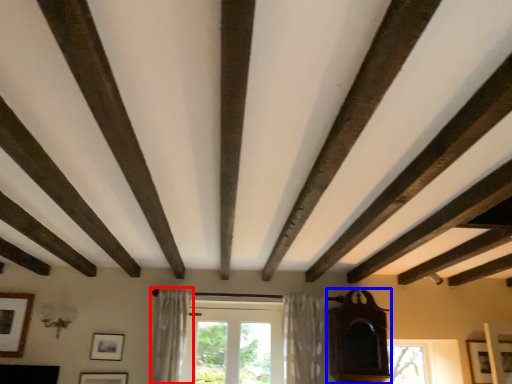
Question: Which point is closer to the camera, curtain (highlighted by a red box) or furniture (highlighted by a blue box)?

Choices:
 (A) curtain
 (B) furniture

Answer: (A)